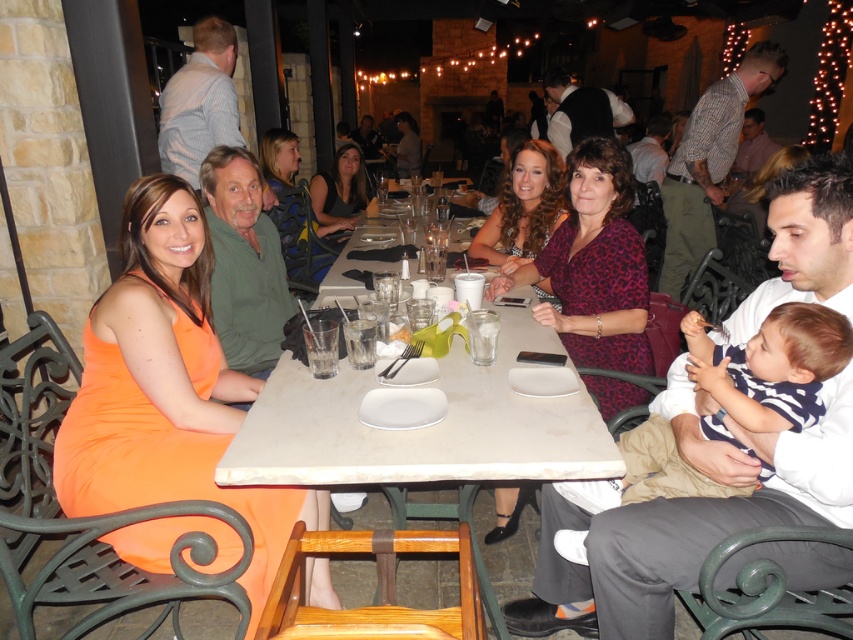
Question: Is shiny brown hair at center wider than blue textured sweater at center?

Choices:
 (A) no
 (B) yes

Answer: (B)

Question: Which point is closer to the camera?

Choices:
 (A) (271, 157)
 (B) (527, 216)
 (C) (616, 186)

Answer: (C)

Question: Estimate the real-world distances between objects in this image. Which object is closer to the shiny brown hair at center?

Choices:
 (A) orange satin dress at left
 (B) blue textured sweater at center

Answer: (A)

Question: Is striped cotton shirt at lower right in front of printed fabric dress at center?

Choices:
 (A) no
 (B) yes

Answer: (B)

Question: Which is nearer to the matte black dress at center?

Choices:
 (A) striped cotton shirt at lower right
 (B) white marble table at center
 (C) orange satin dress at left
 (D) blue textured sweater at center

Answer: (D)

Question: Can you confirm if striped cotton shirt at lower right is wider than blue textured sweater at center?

Choices:
 (A) yes
 (B) no

Answer: (A)